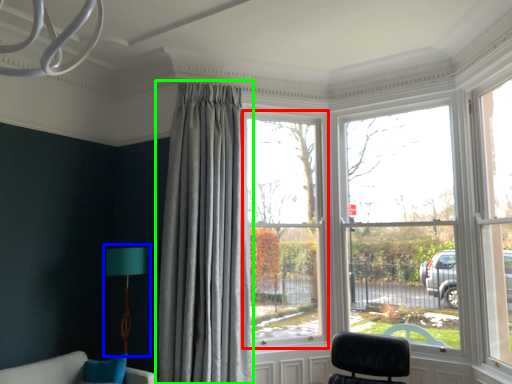
Question: Which is farther away from window (highlighted by a red box)? table lamp (highlighted by a blue box) or curtain (highlighted by a green box)?

Choices:
 (A) table lamp
 (B) curtain

Answer: (A)